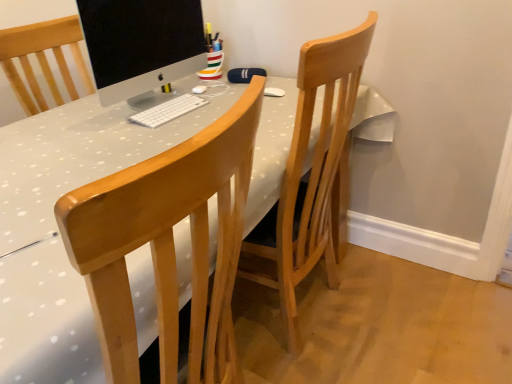
At what (x,y) coordinates should I click in order to perform the action: click on vacant point to the right of white matte keyboard at center. Please return your answer as a coordinate pair (x, y). The image size is (512, 384). Looking at the image, I should click on (222, 105).